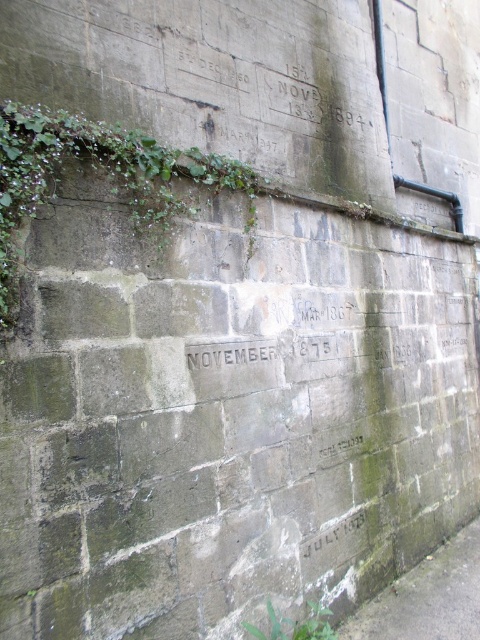
You are standing in front of the weathered stone wall and see two points marked on it. The first point is at coordinate (251,236) and the second point is at (302,634). From your perspective, which point is closer to you?

Point (302,634) is closer to you because it is in front of point (251,236).

You are a botanist examining the green leafy weed at lower center and the dark gray stone text at center. Which object is bigger in size?

The green leafy weed at lower center has a larger size compared to the dark gray stone text at center.

You are an archaeologist examining the stone wall. You notice the green mossy ivy at upper left and the green leafy weed at lower center. Which one is nearer to you?

The green mossy ivy at upper left is closer to the viewer than the green leafy weed at lower center.